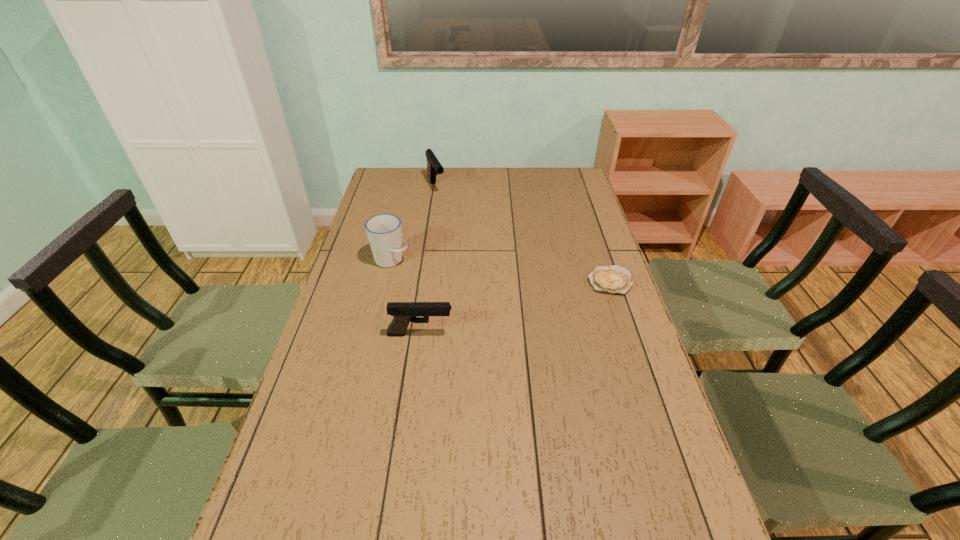
The height and width of the screenshot is (540, 960). I want to click on free location located at the barrel of the taller pistol, so click(x=444, y=206).

At what (x,y) coordinates should I click in order to perform the action: click on free space located at the barrel of the taller pistol. Please return your answer as a coordinate pair (x, y). The width and height of the screenshot is (960, 540). Looking at the image, I should click on (469, 252).

Where is `free spot located with a handle on the side of the cup`? free spot located with a handle on the side of the cup is located at coordinates (419, 270).

The height and width of the screenshot is (540, 960). I want to click on free space located 0.080m with a handle on the side of the cup, so click(x=426, y=273).

This screenshot has height=540, width=960. Find the location of `free spot located 0.290m with a handle on the side of the cup`. free spot located 0.290m with a handle on the side of the cup is located at coordinates (481, 294).

Find the location of a particular element. Image resolution: width=960 pixels, height=540 pixels. object that is at the far edge is located at coordinates (434, 167).

Where is `object present at the left edge`? Image resolution: width=960 pixels, height=540 pixels. object present at the left edge is located at coordinates (383, 230).

Identify the location of object situated at the right edge. This screenshot has height=540, width=960. (614, 279).

Where is `free space at the far edge of the desktop`? This screenshot has height=540, width=960. free space at the far edge of the desktop is located at coordinates pos(500,193).

You are a GUI agent. You are given a task and a screenshot of the screen. Output one action in this format:
    pyautogui.click(x=<x>, y=<y>)
    Task: Click on the vacant area at the left edge
    The height and width of the screenshot is (540, 960).
    Given the screenshot: What is the action you would take?
    pyautogui.click(x=379, y=206)